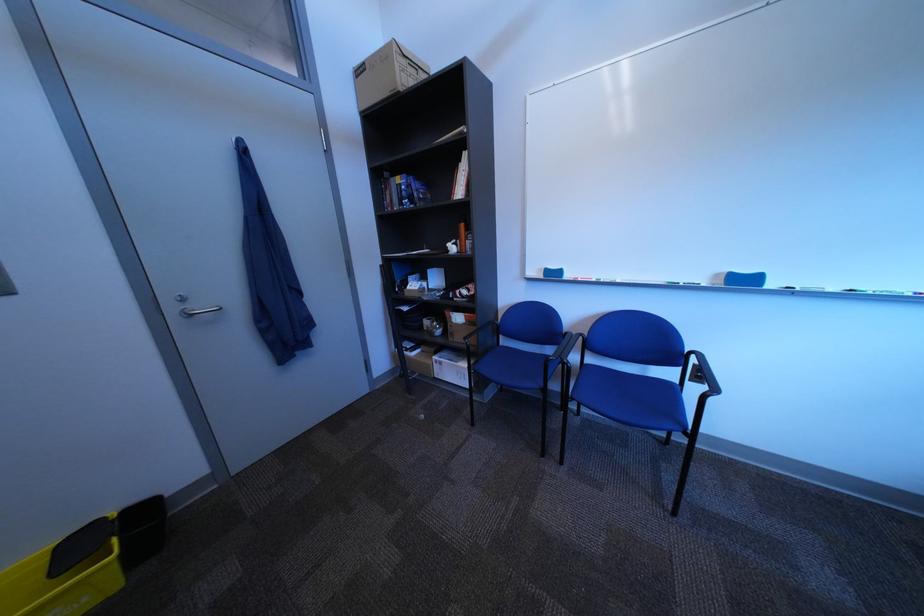
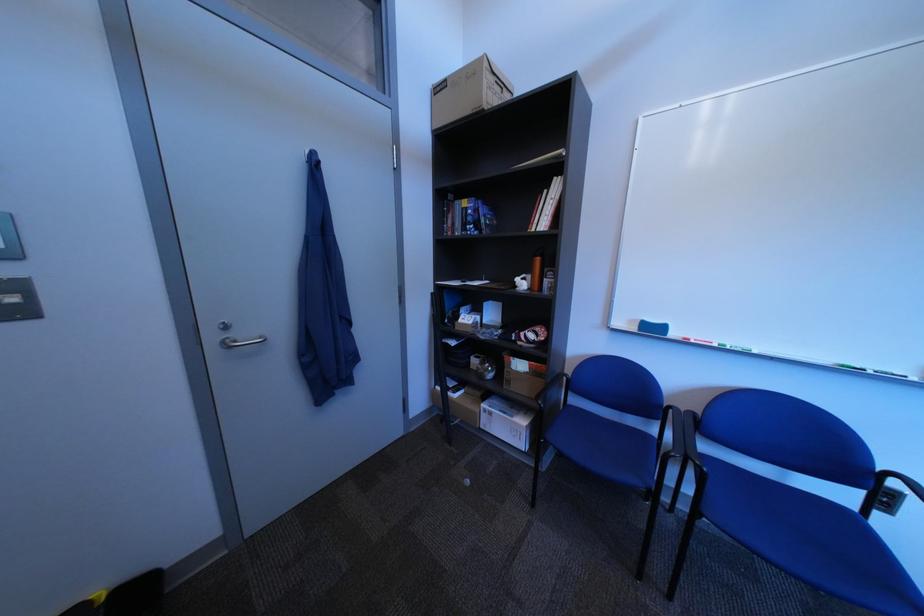
Locate, in the second image, the point that corresponds to point 610,282 in the first image.

(732, 347)